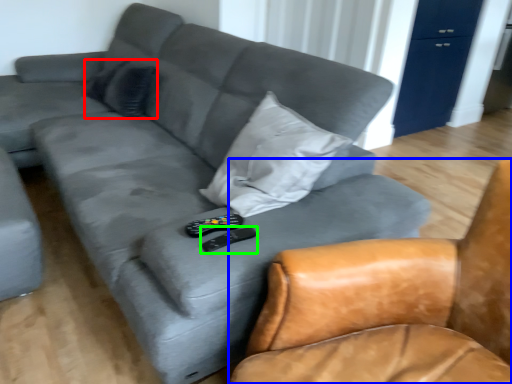
Question: Which object is the farthest from pillow (highlighted by a red box)? Choose among these: chair (highlighted by a blue box) or remote (highlighted by a green box).

Choices:
 (A) chair
 (B) remote

Answer: (A)